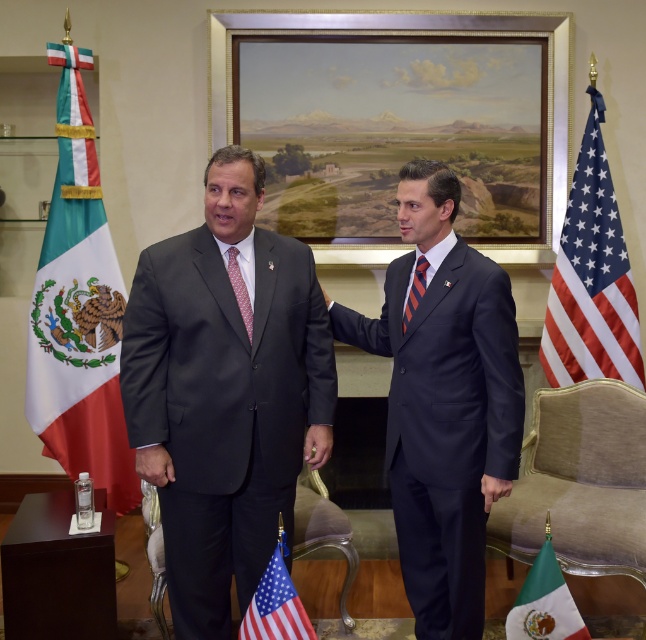
Looking at this image, who is positioned more to the left, green felt flag at lower right or red silk tie at center?

red silk tie at center is more to the left.

Between point (557, 618) and point (247, 316), which one is positioned in front?

Point (557, 618) is more forward.

The width and height of the screenshot is (646, 640). In order to click on green felt flag at lower right in this screenshot , I will do `click(545, 604)`.

The height and width of the screenshot is (640, 646). I want to click on green felt flag at lower right, so click(545, 604).

How far apart are textured fabric flag at left and wooden framed painting at center?

textured fabric flag at left and wooden framed painting at center are 4.59 feet apart from each other.

Who is positioned more to the right, textured fabric flag at left or wooden framed painting at center?

From the viewer's perspective, wooden framed painting at center appears more on the right side.

At what (x,y) coordinates should I click in order to perform the action: click on textured fabric flag at left. Please return your answer as a coordinate pair (x, y). Looking at the image, I should click on (78, 308).

Is point (563, 304) positioned behind point (550, 582)?

Yes, it is behind point (550, 582).

Between silky blue-white stars and stripes at upper right and green felt flag at lower right, which one appears on the right side from the viewer's perspective?

silky blue-white stars and stripes at upper right

The image size is (646, 640). What are the coordinates of `silky blue-white stars and stripes at upper right` in the screenshot? It's located at (590, 278).